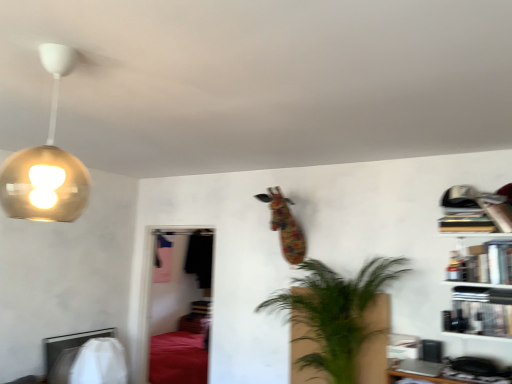
Identify the location of vacant space situated above metallic silver book at right, placed as the 3th book when sorted from top to bottom (from a real-world perspective). (481, 302).